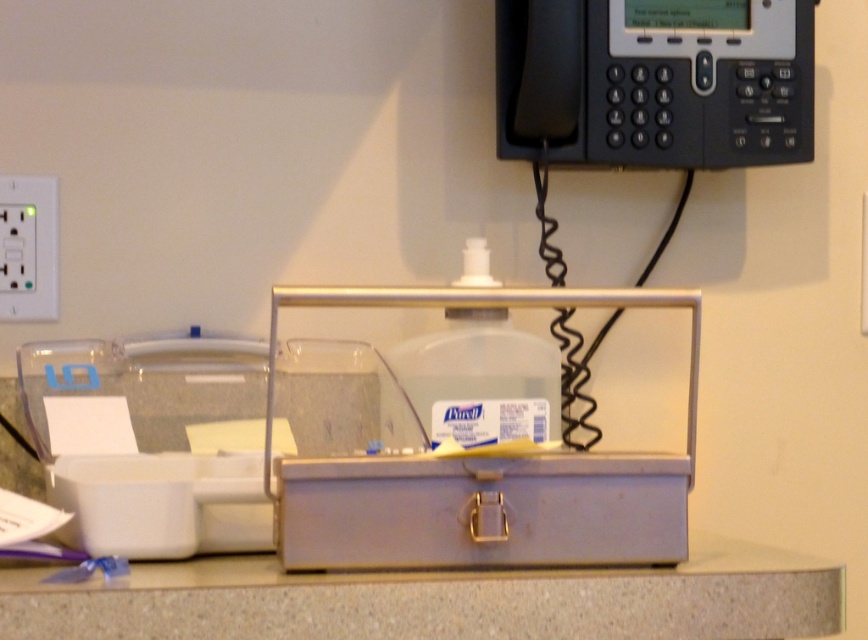
Question: Which point is farther to the camera?

Choices:
 (A) pos(205,624)
 (B) pos(740,52)

Answer: (B)

Question: Can you confirm if gray matte counter top at center is wider than black plastic phone at upper right?

Choices:
 (A) yes
 (B) no

Answer: (A)

Question: From the image, what is the correct spatial relationship of gray matte counter top at center in relation to black plastic phone at upper right?

Choices:
 (A) below
 (B) above

Answer: (A)

Question: Is gray matte counter top at center closer to camera compared to black plastic phone at upper right?

Choices:
 (A) yes
 (B) no

Answer: (A)